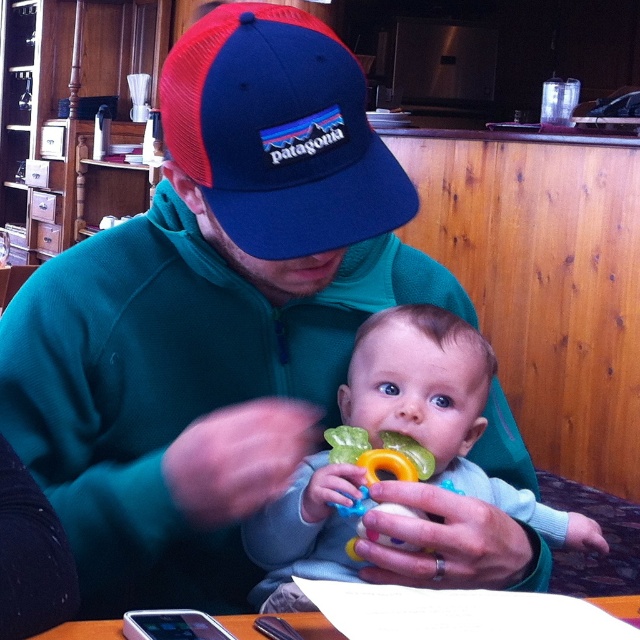
Where is the light blue fabric baby at center located in the image?

The light blue fabric baby at center is located at point (442, 408) in the image.

You are a photographer setting up for a family photo. You need to position a small prop on the wooden table at lower center so that it is directly in front of the light blue fabric baby at center. Based on their current positions, where should you place the prop relative to the baby?

The light blue fabric baby at center is positioned on the right side of wooden table at lower center, so you should place the prop on the left side of the baby to have it directly in front.